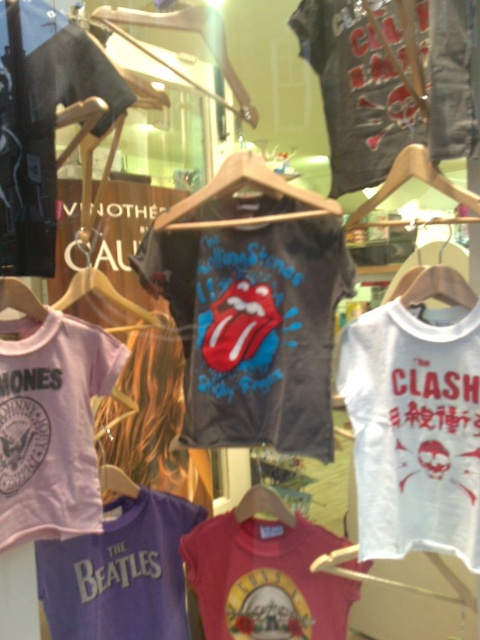
Question: Can you confirm if dark gray t-shirt with glossy print at center is thinner than matte black t-shirt at upper left?

Choices:
 (A) no
 (B) yes

Answer: (A)

Question: Estimate the real-world distances between objects in this image. Which object is farther from the purple cotton t-shirt at center?

Choices:
 (A) dark gray t-shirt at upper center
 (B) dark gray t-shirt with glossy print at center
 (C) white fabric hanger at center
 (D) matte black t-shirt at upper left

Answer: (A)

Question: Among these objects, which one is nearest to the camera?

Choices:
 (A) white cotton t-shirt at right
 (B) matte pink t-shirt at center
 (C) dark gray t-shirt at upper center

Answer: (C)

Question: Can you confirm if dark gray t-shirt with glossy print at center is positioned above matte pink t-shirt at center?

Choices:
 (A) yes
 (B) no

Answer: (A)

Question: Which of the following is the farthest from the observer?

Choices:
 (A) purple cotton t-shirt at left
 (B) matte pink t-shirt at center

Answer: (B)

Question: Can you confirm if purple cotton t-shirt at left is bigger than matte pink t-shirt at center?

Choices:
 (A) no
 (B) yes

Answer: (A)